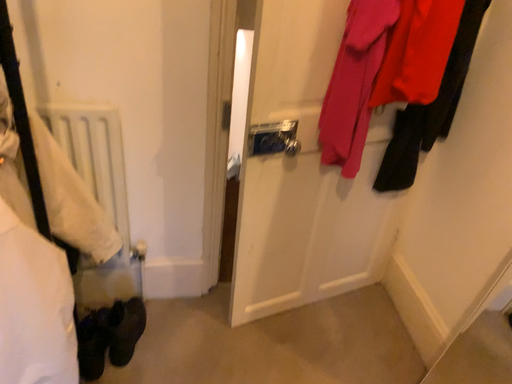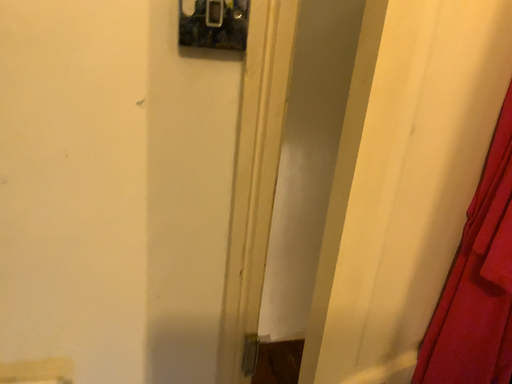
Question: How did the camera likely rotate when shooting the video?

Choices:
 (A) rotated upward
 (B) rotated downward

Answer: (A)